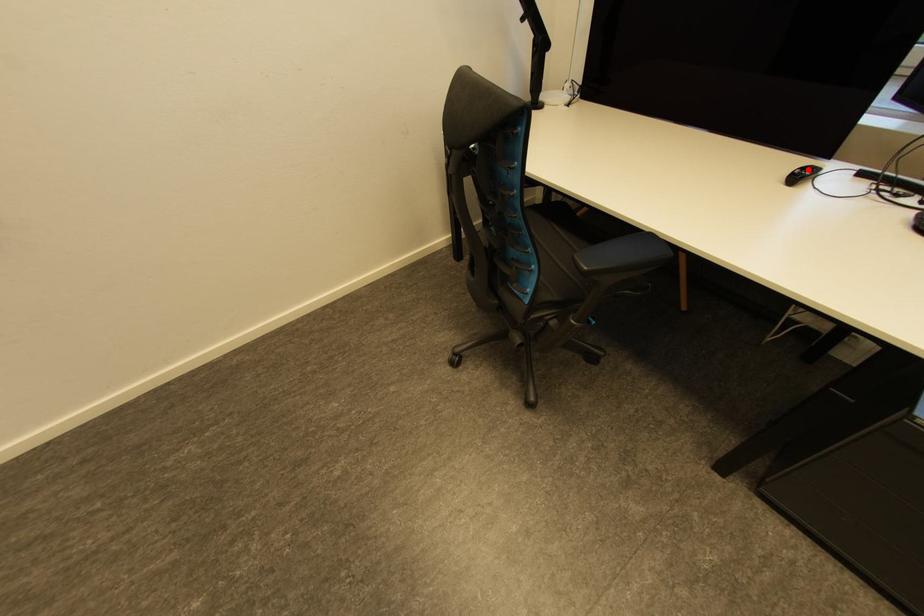
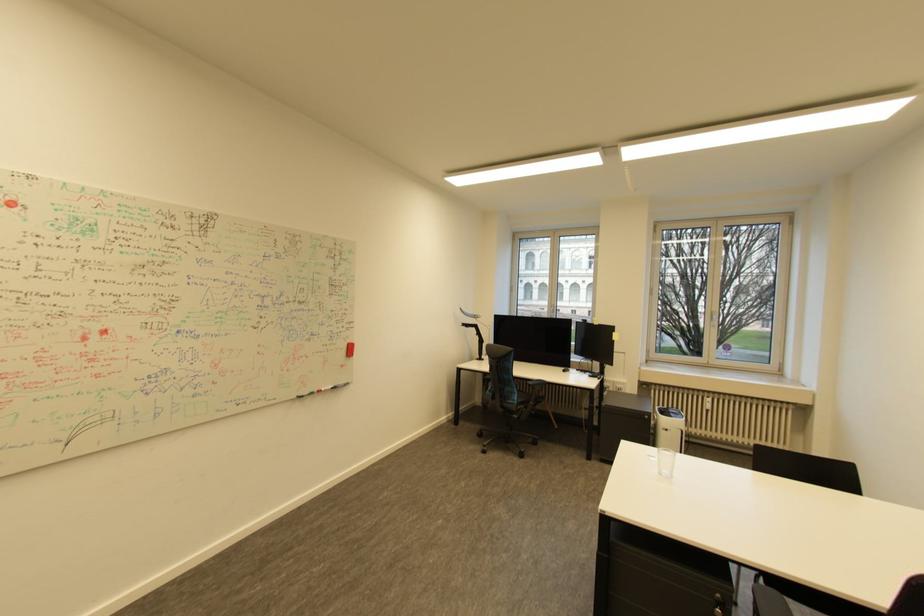
Question: I am providing you with two images of the same scene from different viewpoints. A red point is marked on the first image. At the location where the point appears in image 1, is it still visible in image 2?

Choices:
 (A) Yes
 (B) No

Answer: (B)